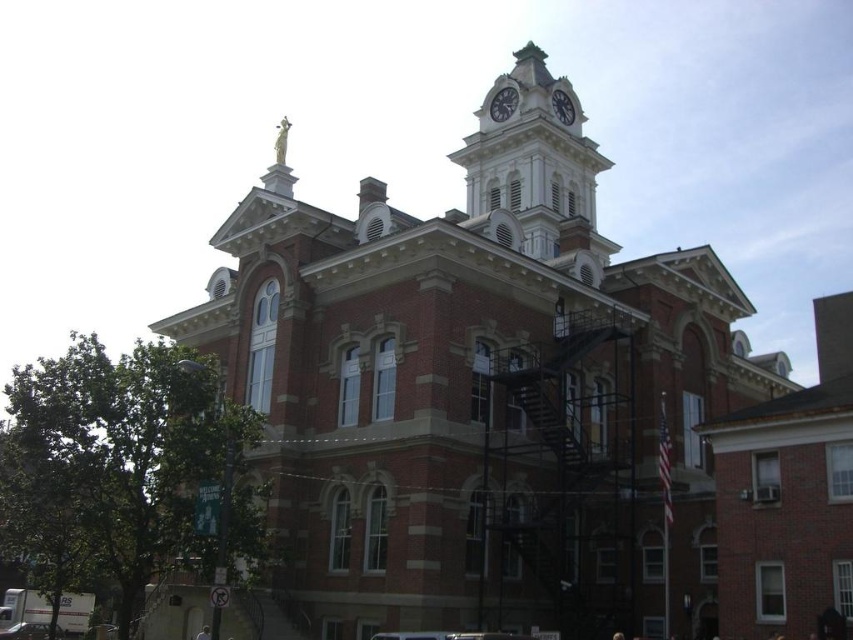
Who is positioned more to the right, white stone clock at upper center or white glossy clock at upper center?

white glossy clock at upper center is more to the right.

In the scene shown: Is white stone clock at upper center closer to the viewer compared to white glossy clock at upper center?

No.

Is point (498, 108) positioned behind point (560, 92)?

Yes, point (498, 108) is behind point (560, 92).

Locate an element on the screen. Image resolution: width=853 pixels, height=640 pixels. white stone clock at upper center is located at coordinates (503, 104).

What do you see at coordinates (532, 161) in the screenshot? I see `white stone clock tower at upper center` at bounding box center [532, 161].

Is white stone clock tower at upper center below white glossy clock at upper center?

Yes.

Locate an element on the screen. The height and width of the screenshot is (640, 853). white stone clock tower at upper center is located at coordinates (532, 161).

Locate an element on the screen. Image resolution: width=853 pixels, height=640 pixels. white stone clock tower at upper center is located at coordinates (532, 161).

Describe the element at coordinates (532, 161) in the screenshot. I see `white stone clock tower at upper center` at that location.

Can you confirm if white stone clock tower at upper center is positioned above white stone clock at upper center?

No.

Find the location of a particular element. white stone clock tower at upper center is located at coordinates (532, 161).

Identify the location of white stone clock tower at upper center. (532, 161).